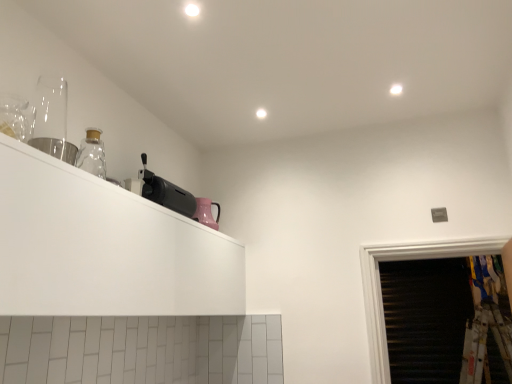
Image resolution: width=512 pixels, height=384 pixels. What do you see at coordinates (56, 148) in the screenshot?
I see `metallic silver cup at upper left, the 1th appliance when ordered from front to back` at bounding box center [56, 148].

In order to click on black plastic toaster at upper left, the second appliance positioned from the back in this screenshot , I will do [167, 194].

Where is `white matte cabinet at upper left`? The width and height of the screenshot is (512, 384). white matte cabinet at upper left is located at coordinates (104, 247).

Based on the photo, how different are the orientations of metallic silver cup at upper left, arranged as the 1th appliance when viewed from the left, and pink glossy kettle at upper center, the third appliance from the front, in degrees?

5.16 degrees.

From the picture: Considering the sizes of objects metallic silver cup at upper left, arranged as the 1th appliance when viewed from the left, and pink glossy kettle at upper center, which is the first appliance from back to front, in the image provided, who is taller, metallic silver cup at upper left, arranged as the 1th appliance when viewed from the left, or pink glossy kettle at upper center, which is the first appliance from back to front,?

pink glossy kettle at upper center, which is the first appliance from back to front.

From a real-world perspective, which is physically above, metallic silver cup at upper left, the third appliance from the right, or pink glossy kettle at upper center, the 3th appliance when ordered from left to right?

In real-world perspective, pink glossy kettle at upper center, the 3th appliance when ordered from left to right, is above.

Is metallic silver cup at upper left, placed as the 3th appliance when sorted from back to front, at the right side of pink glossy kettle at upper center, the third appliance from the front?

No, metallic silver cup at upper left, placed as the 3th appliance when sorted from back to front, is not to the right of pink glossy kettle at upper center, the third appliance from the front.

Is pink glossy kettle at upper center, the 3th appliance when ordered from left to right, to the left of metallic silver cup at upper left, arranged as the 1th appliance when viewed from the left, from the viewer's perspective?

In fact, pink glossy kettle at upper center, the 3th appliance when ordered from left to right, is to the right of metallic silver cup at upper left, arranged as the 1th appliance when viewed from the left.

What's the angular difference between pink glossy kettle at upper center, which is the first appliance from back to front, and metallic silver cup at upper left, the 1th appliance when ordered from front to back,'s facing directions?

There is a 5.16-degree angle between the facing directions of pink glossy kettle at upper center, which is the first appliance from back to front, and metallic silver cup at upper left, the 1th appliance when ordered from front to back.

Consider the image. From a real-world perspective, is pink glossy kettle at upper center, which ranks as the 1th appliance in right-to-left order, on top of metallic silver cup at upper left, arranged as the 1th appliance when viewed from the left?

Yes, from a real-world perspective, pink glossy kettle at upper center, which ranks as the 1th appliance in right-to-left order, is on top of metallic silver cup at upper left, arranged as the 1th appliance when viewed from the left.

From the image's perspective, count 2nd appliances downward from the metallic silver cup at upper left, the 1th appliance when ordered from front to back, and point to it. Please provide its 2D coordinates.

[(206, 213)]

Is the surface of pink glossy kettle at upper center, the third appliance from the front, in direct contact with white matte cabinet at upper left?

No, pink glossy kettle at upper center, the third appliance from the front, is not beside white matte cabinet at upper left.

Between pink glossy kettle at upper center, which ranks as the 1th appliance in right-to-left order, and white matte cabinet at upper left, which one has larger size?

white matte cabinet at upper left is bigger.

Could you tell me if pink glossy kettle at upper center, the third appliance from the front, is turned towards white matte cabinet at upper left?

No, pink glossy kettle at upper center, the third appliance from the front, is not facing towards white matte cabinet at upper left.

Choose the correct answer: Is black plastic toaster at upper left, which is the 2th appliance in front-to-back order, inside pink glossy kettle at upper center, the 3th appliance when ordered from left to right, or outside it?

The correct answer is: outside.

Does point (173, 210) appear closer or farther from the camera than point (200, 201)?

Point (173, 210).

Is black plastic toaster at upper left, which is the 2th appliance in front-to-back order, looking in the opposite direction of pink glossy kettle at upper center, which ranks as the 1th appliance in right-to-left order?

No, black plastic toaster at upper left, which is the 2th appliance in front-to-back order,'s orientation is not away from pink glossy kettle at upper center, which ranks as the 1th appliance in right-to-left order.

Is black plastic toaster at upper left, which is the 2th appliance in front-to-back order, bigger than pink glossy kettle at upper center, the third appliance from the front?

Indeed, black plastic toaster at upper left, which is the 2th appliance in front-to-back order, has a larger size compared to pink glossy kettle at upper center, the third appliance from the front.

Can you tell me how much pink glossy kettle at upper center, which ranks as the 1th appliance in right-to-left order, and black plastic toaster at upper left, the second appliance positioned from the back, differ in facing direction?

0.00176 degrees.

Based on their sizes in the image, would you say pink glossy kettle at upper center, the third appliance from the front, is bigger or smaller than black plastic toaster at upper left, which ranks as the 2th appliance in left-to-right order?

pink glossy kettle at upper center, the third appliance from the front, is smaller than black plastic toaster at upper left, which ranks as the 2th appliance in left-to-right order.

Find the location of a particular element. the 1st appliance to the left when counting from the pink glossy kettle at upper center, which ranks as the 1th appliance in right-to-left order is located at coordinates (167, 194).

Is pink glossy kettle at upper center, which ranks as the 1th appliance in right-to-left order, far from black plastic toaster at upper left, the second appliance positioned from the back?

They are positioned close to each other.

In the image, is metallic silver cup at upper left, arranged as the 1th appliance when viewed from the left, on the left side or the right side of white matte cabinet at upper left?

metallic silver cup at upper left, arranged as the 1th appliance when viewed from the left, is to the left of white matte cabinet at upper left.

In the scene shown: Between metallic silver cup at upper left, arranged as the 1th appliance when viewed from the left, and white matte cabinet at upper left, which one has larger width?

Wider between the two is white matte cabinet at upper left.

Is metallic silver cup at upper left, arranged as the 1th appliance when viewed from the left, not inside white matte cabinet at upper left?

metallic silver cup at upper left, arranged as the 1th appliance when viewed from the left, is positioned outside white matte cabinet at upper left.

Considering the positions of objects metallic silver cup at upper left, arranged as the 1th appliance when viewed from the left, and white matte cabinet at upper left in the image provided, who is in front, metallic silver cup at upper left, arranged as the 1th appliance when viewed from the left, or white matte cabinet at upper left?

white matte cabinet at upper left is closer to the camera.

From the image's perspective, which object appears higher, white matte cabinet at upper left or metallic silver cup at upper left, arranged as the 1th appliance when viewed from the left?

metallic silver cup at upper left, arranged as the 1th appliance when viewed from the left, from the image's perspective.

Can you confirm if white matte cabinet at upper left is positioned to the left of metallic silver cup at upper left, the 1th appliance when ordered from front to back?

Incorrect, white matte cabinet at upper left is not on the left side of metallic silver cup at upper left, the 1th appliance when ordered from front to back.

Based on the photo, does white matte cabinet at upper left come in front of metallic silver cup at upper left, the third appliance from the right?

Yes, white matte cabinet at upper left is in front of metallic silver cup at upper left, the third appliance from the right.

From the picture: From a real-world perspective, which object stands above the other?

metallic silver cup at upper left, arranged as the 1th appliance when viewed from the left, is physically above.

Identify the location of appliance that is the 2nd object to the right of the metallic silver cup at upper left, arranged as the 1th appliance when viewed from the left, starting at the anchor. (206, 213).

You are a GUI agent. You are given a task and a screenshot of the screen. Output one action in this format:
    pyautogui.click(x=<x>, y=<y>)
    Task: Click on the 1st appliance directly above the metallic silver cup at upper left, the third appliance from the right (from a real-world perspective)
    
    Given the screenshot: What is the action you would take?
    pyautogui.click(x=206, y=213)

Based on their spatial positions, is pink glossy kettle at upper center, which is the first appliance from back to front, or metallic silver cup at upper left, the third appliance from the right, further from white matte cabinet at upper left?

pink glossy kettle at upper center, which is the first appliance from back to front, is further to white matte cabinet at upper left.

Which object lies further to the anchor point black plastic toaster at upper left, the 2th appliance viewed from the right, metallic silver cup at upper left, the 1th appliance when ordered from front to back, or white matte cabinet at upper left?

The object further to black plastic toaster at upper left, the 2th appliance viewed from the right, is metallic silver cup at upper left, the 1th appliance when ordered from front to back.

When comparing their distances from metallic silver cup at upper left, the 1th appliance when ordered from front to back, does black plastic toaster at upper left, which is the 2th appliance in front-to-back order, or white matte cabinet at upper left seem further?

Based on the image, black plastic toaster at upper left, which is the 2th appliance in front-to-back order, appears to be further to metallic silver cup at upper left, the 1th appliance when ordered from front to back.

From the image, which object appears to be nearer to pink glossy kettle at upper center, the third appliance from the front, metallic silver cup at upper left, placed as the 3th appliance when sorted from back to front, or white matte cabinet at upper left?

Among the two, white matte cabinet at upper left is located nearer to pink glossy kettle at upper center, the third appliance from the front.

From the image, which object appears to be nearer to pink glossy kettle at upper center, which ranks as the 1th appliance in right-to-left order, white matte cabinet at upper left or black plastic toaster at upper left, which ranks as the 2th appliance in left-to-right order?

Based on the image, black plastic toaster at upper left, which ranks as the 2th appliance in left-to-right order, appears to be nearer to pink glossy kettle at upper center, which ranks as the 1th appliance in right-to-left order.

From the image, which object appears to be farther from metallic silver cup at upper left, arranged as the 1th appliance when viewed from the left, white matte cabinet at upper left or pink glossy kettle at upper center, which is the first appliance from back to front?

Based on the image, pink glossy kettle at upper center, which is the first appliance from back to front, appears to be further to metallic silver cup at upper left, arranged as the 1th appliance when viewed from the left.

In the scene shown: Based on their spatial positions, is white matte cabinet at upper left or black plastic toaster at upper left, the 2th appliance viewed from the right, further from metallic silver cup at upper left, the 1th appliance when ordered from front to back?

Based on the image, black plastic toaster at upper left, the 2th appliance viewed from the right, appears to be further to metallic silver cup at upper left, the 1th appliance when ordered from front to back.

Estimate the real-world distances between objects in this image. Which object is closer to black plastic toaster at upper left, which ranks as the 2th appliance in left-to-right order, white matte cabinet at upper left or metallic silver cup at upper left, the third appliance from the right?

The object closer to black plastic toaster at upper left, which ranks as the 2th appliance in left-to-right order, is white matte cabinet at upper left.

Locate an element on the screen. This screenshot has height=384, width=512. appliance between white matte cabinet at upper left and black plastic toaster at upper left, which ranks as the 2th appliance in left-to-right order, in the front-back direction is located at coordinates (56, 148).

Where is `appliance located between metallic silver cup at upper left, the third appliance from the right, and pink glossy kettle at upper center, which ranks as the 1th appliance in right-to-left order, in the depth direction`? Image resolution: width=512 pixels, height=384 pixels. appliance located between metallic silver cup at upper left, the third appliance from the right, and pink glossy kettle at upper center, which ranks as the 1th appliance in right-to-left order, in the depth direction is located at coordinates pyautogui.click(x=167, y=194).